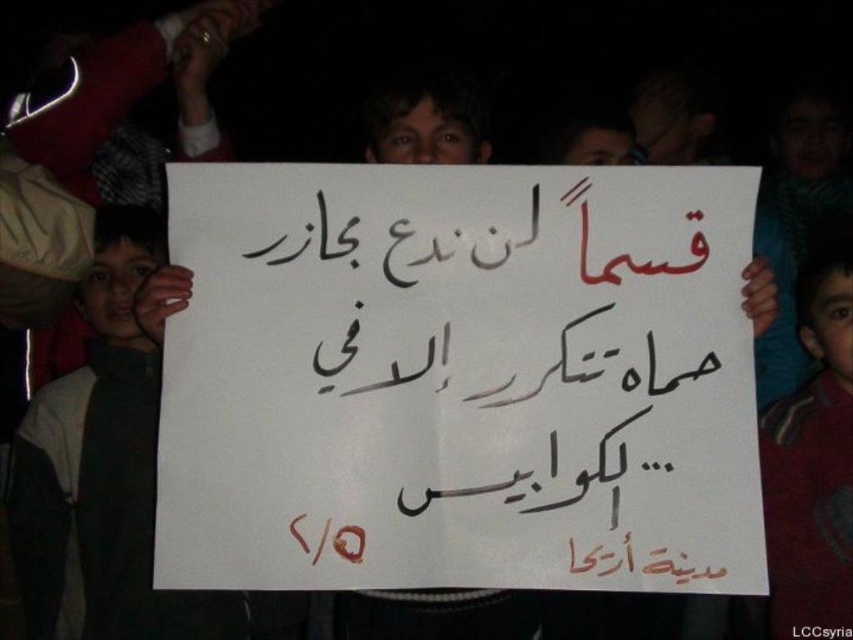
Which of these two, white paper sign at center or maroon fabric shirt at right, stands shorter?

white paper sign at center

Who is positioned more to the left, white paper sign at center or maroon fabric shirt at right?

white paper sign at center

Find the location of a particular element. Image resolution: width=853 pixels, height=640 pixels. white paper sign at center is located at coordinates (459, 380).

The width and height of the screenshot is (853, 640). What are the coordinates of `white paper sign at center` in the screenshot? It's located at (459, 380).